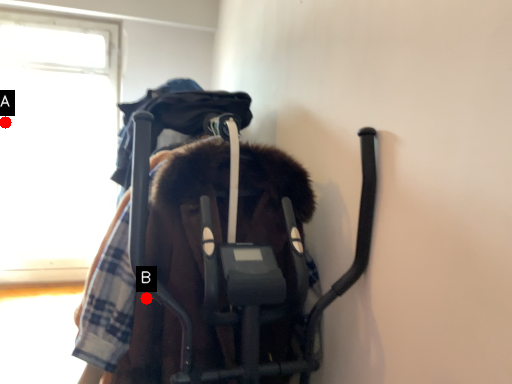
Question: Two points are circled on the image, labeled by A and B beside each circle. Which point is further to the camera?

Choices:
 (A) A is further
 (B) B is further

Answer: (A)